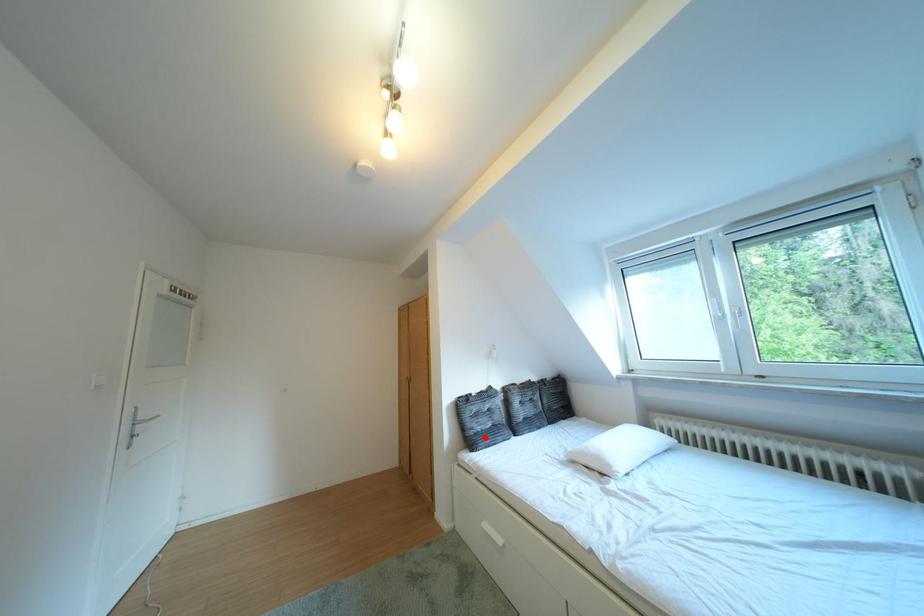
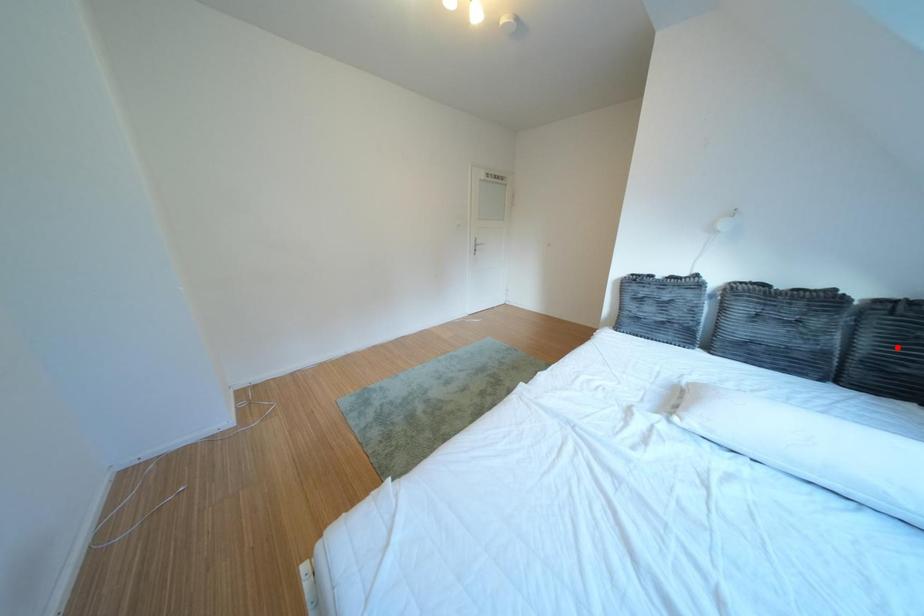
I am providing you with two images of the same scene from different viewpoints. A red point is marked on the first image and another point is marked on the second image. Are the points marked in image1 and image2 representing the same 3D position?

No